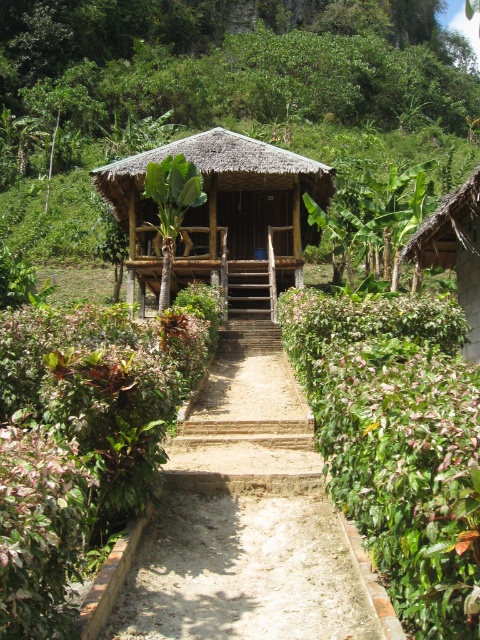
Question: Is thatched bamboo hut at center positioned behind thatched roof hut at right?

Choices:
 (A) no
 (B) yes

Answer: (B)

Question: Which point is closer to the camera?

Choices:
 (A) thatched bamboo hut at center
 (B) thatched roof hut at right

Answer: (B)

Question: Which object is closer to the camera taking this photo?

Choices:
 (A) thatched roof hut at right
 (B) thatched bamboo hut at center

Answer: (A)

Question: Which of these objects is positioned farthest from the thatched roof hut at right?

Choices:
 (A) brown gravel path at center
 (B) thatched bamboo hut at center

Answer: (B)

Question: Is brown gravel path at center wider than thatched bamboo hut at center?

Choices:
 (A) yes
 (B) no

Answer: (B)

Question: Is brown gravel path at center closer to the viewer compared to thatched roof hut at right?

Choices:
 (A) no
 (B) yes

Answer: (B)